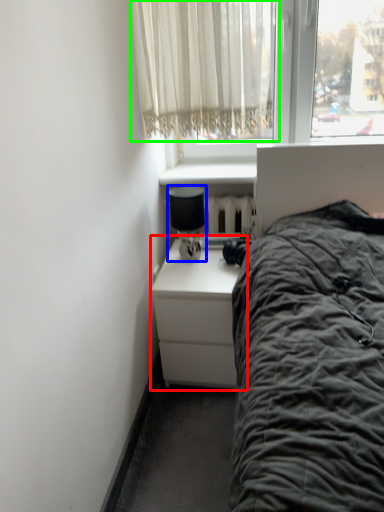
Question: Which object is positioned closest to nightstand (highlighted by a red box)? Select from lamp (highlighted by a blue box) and curtain (highlighted by a green box).

Choices:
 (A) lamp
 (B) curtain

Answer: (A)